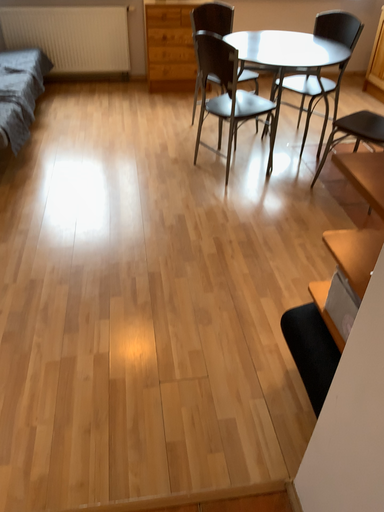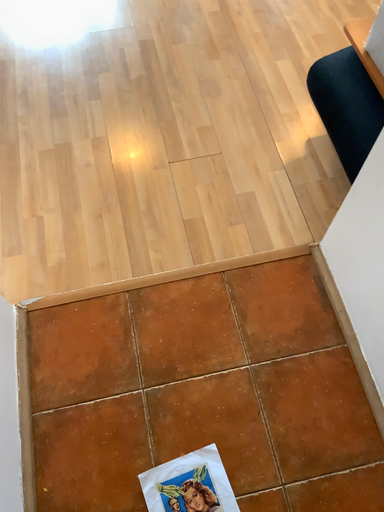
Question: How did the camera likely rotate when shooting the video?

Choices:
 (A) rotated upward
 (B) rotated downward

Answer: (B)